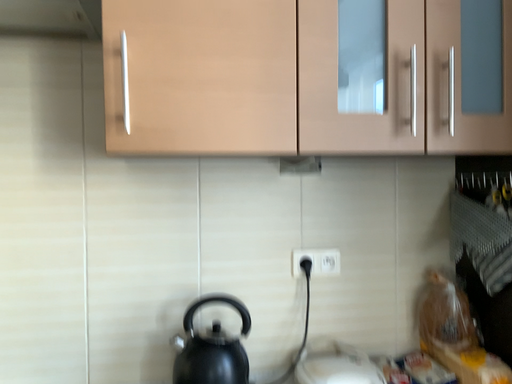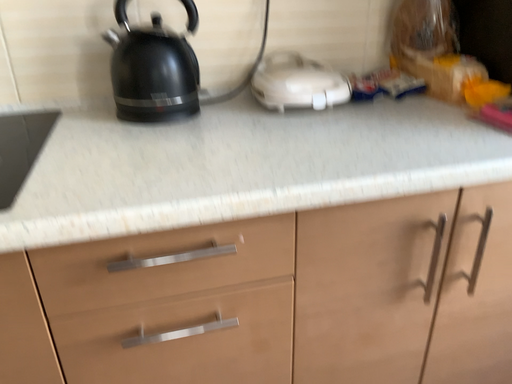
Question: How did the camera likely rotate when shooting the video?

Choices:
 (A) rotated upward
 (B) rotated downward

Answer: (B)